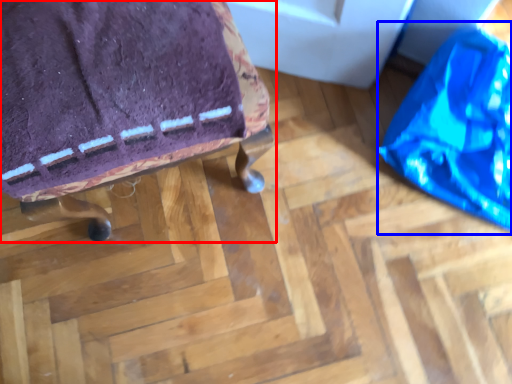
Question: Which point is closer to the camera, furniture (highlighted by a red box) or bean bag chair (highlighted by a blue box)?

Choices:
 (A) furniture
 (B) bean bag chair

Answer: (A)